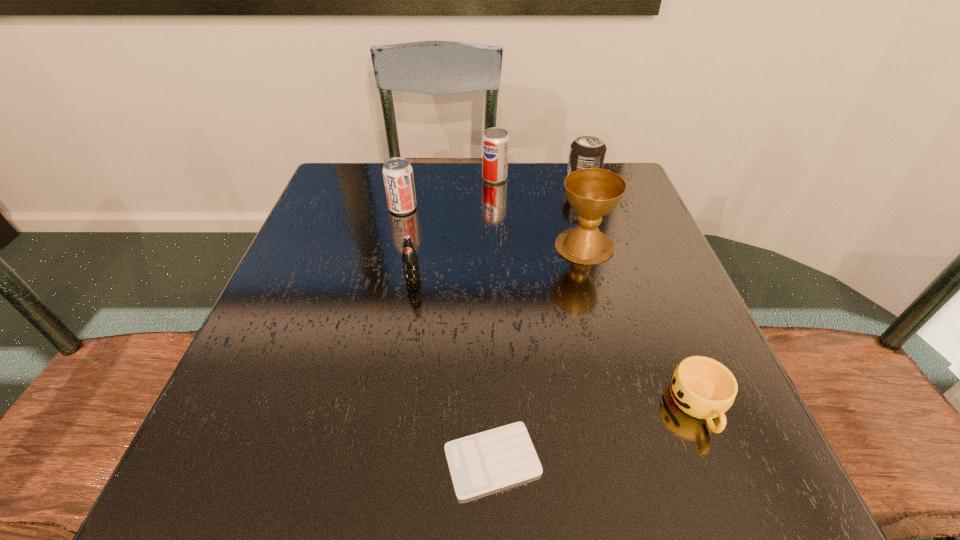
At what (x,y) coordinates should I click in order to perform the action: click on free space located on the front of the fourth nearest object. Please return your answer as a coordinate pair (x, y). The height and width of the screenshot is (540, 960). Looking at the image, I should click on (626, 397).

Locate an element on the screen. The height and width of the screenshot is (540, 960). vacant space positioned 0.090m on the left of the third pop from left to right is located at coordinates (447, 178).

You are a GUI agent. You are given a task and a screenshot of the screen. Output one action in this format:
    pyautogui.click(x=<x>, y=<y>)
    Task: Click on the vacant space located on the front of the leftmost object
    This screenshot has height=540, width=960.
    Given the screenshot: What is the action you would take?
    pyautogui.click(x=372, y=340)

This screenshot has width=960, height=540. Identify the location of free space located on the front of the rightmost pop. (590, 206).

This screenshot has width=960, height=540. In order to click on vacant region located on the front label of the nearest pop in this screenshot , I will do `click(407, 316)`.

Locate an element on the screen. The width and height of the screenshot is (960, 540). vacant region located 0.060m on the left of the cup is located at coordinates (631, 406).

Image resolution: width=960 pixels, height=540 pixels. I want to click on vacant space located 0.130m on the left of the shortest object, so click(349, 460).

Locate an element on the screen. object situated at the near edge is located at coordinates (483, 462).

You are a GUI agent. You are given a task and a screenshot of the screen. Output one action in this format:
    pyautogui.click(x=<x>, y=<y>)
    Task: Click on the chalice that is at the right edge
    The height and width of the screenshot is (540, 960).
    Given the screenshot: What is the action you would take?
    pyautogui.click(x=592, y=192)

Find the location of a particular element. soda can that is at the right edge is located at coordinates (588, 150).